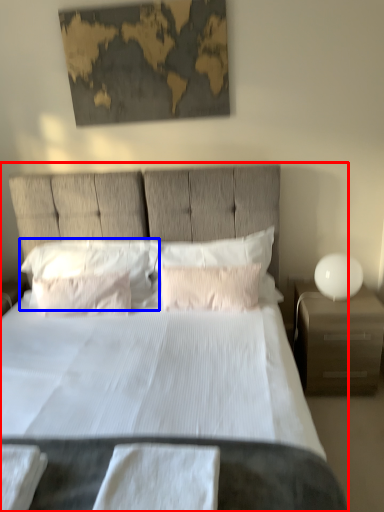
Question: Which of the following is the farthest to the observer, bed (highlighted by a red box) or pillow (highlighted by a blue box)?

Choices:
 (A) bed
 (B) pillow

Answer: (B)